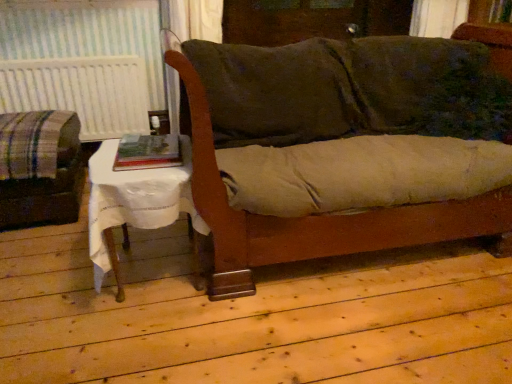
At what (x,y) coordinates should I click in order to perform the action: click on vacant area on top of white textured radiator at left (from a real-world perspective). Please return your answer as a coordinate pair (x, y). Image resolution: width=512 pixels, height=384 pixels. Looking at the image, I should click on (67, 57).